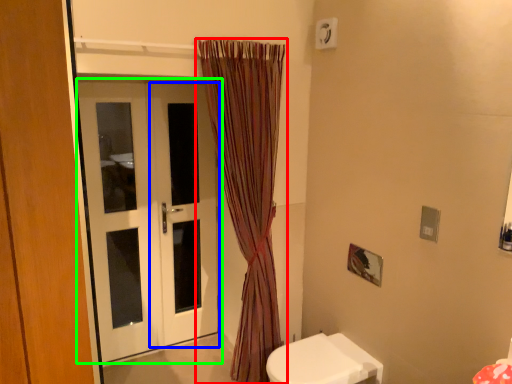
Question: Which object is positioned farthest from curtain (highlighted by a red box)? Select from screen door (highlighted by a blue box) and door (highlighted by a green box).

Choices:
 (A) screen door
 (B) door

Answer: (B)